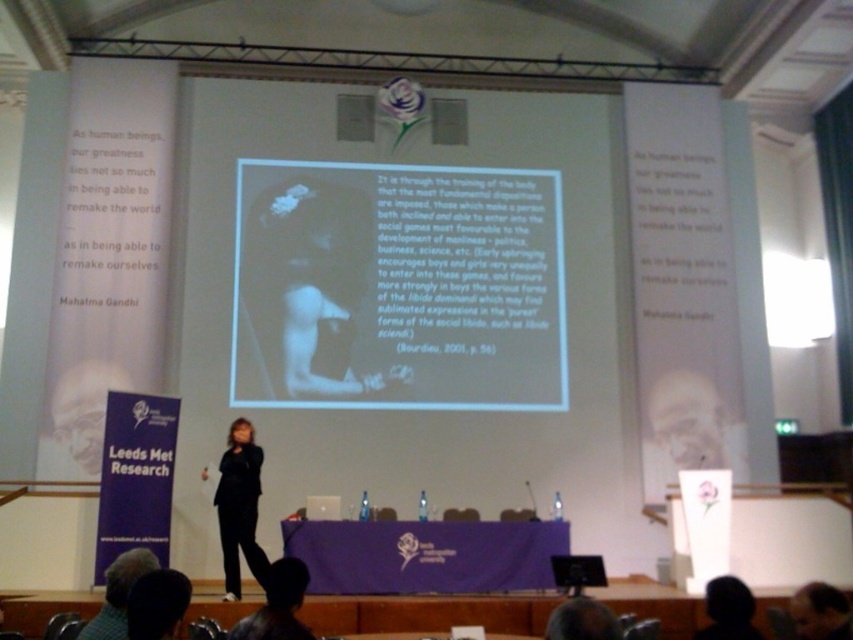
Does black suit at center have a lesser height compared to dark fabric jacket at lower center?

In fact, black suit at center may be taller than dark fabric jacket at lower center.

Which is above, black suit at center or dark fabric jacket at lower center?

black suit at center is above.

Where is `black suit at center`? The image size is (853, 640). black suit at center is located at coordinates (84, 408).

Where is `black suit at center`? This screenshot has height=640, width=853. black suit at center is located at coordinates (84, 408).

Is black fabric suit at center further to the viewer compared to black matte head at lower right?

Yes.

Is point (235, 556) closer to viewer compared to point (717, 618)?

No.

Who is more distant from viewer, [230,429] or [732,588]?

The point [230,429] is more distant.

Find the location of a particular element. The width and height of the screenshot is (853, 640). black fabric suit at center is located at coordinates (239, 506).

Can you confirm if black matte figure at center is wider than black matte head at lower right?

Correct, the width of black matte figure at center exceeds that of black matte head at lower right.

Does point (390, 371) come closer to viewer compared to point (717, 579)?

That is False.

Between point (312, 202) and point (721, 582), which one is positioned in front?

Point (721, 582) is more forward.

Where is `black matte figure at center`? The width and height of the screenshot is (853, 640). black matte figure at center is located at coordinates (309, 289).